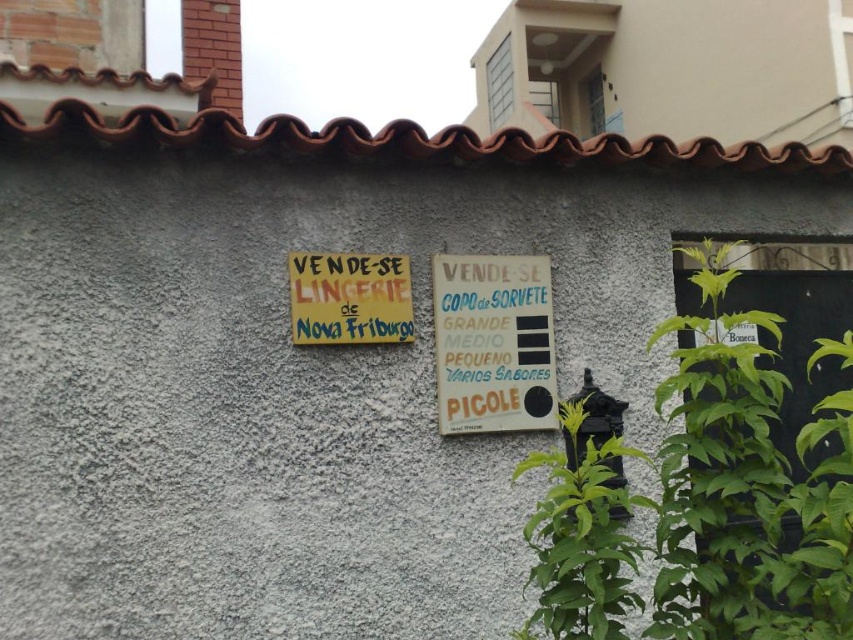
Can you confirm if white paper sign at center is wider than yellow paper sign at upper center?

Correct, the width of white paper sign at center exceeds that of yellow paper sign at upper center.

Which is behind, point (497, 308) or point (364, 292)?

The point (497, 308) is behind.

Where is `white paper sign at center`? The image size is (853, 640). white paper sign at center is located at coordinates (492, 342).